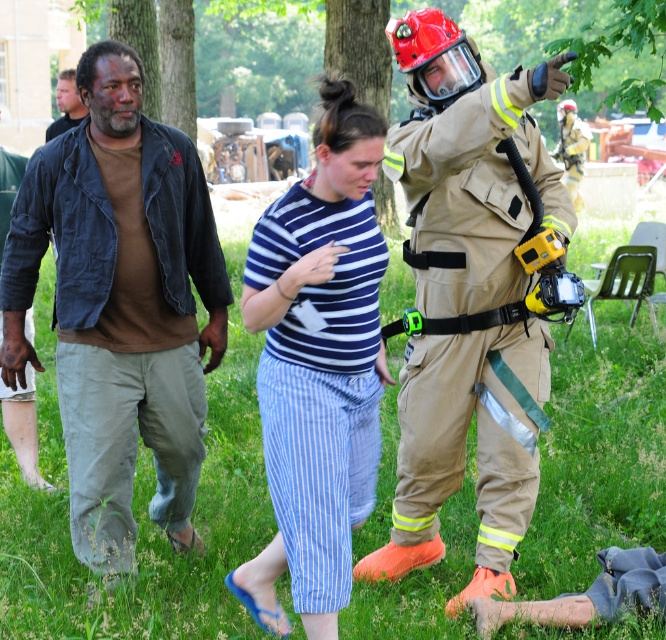
Which is below, brown cotton shirt at left or blue striped pants at center?

blue striped pants at center

Based on the photo, between brown cotton shirt at left and blue striped pants at center, which one has less height?

Standing shorter between the two is blue striped pants at center.

Where is `brown cotton shirt at left`? This screenshot has height=640, width=666. brown cotton shirt at left is located at coordinates (121, 305).

Who is more distant from viewer, (330,163) or (567,157)?

Point (567,157)

Does blue striped pants at center have a larger size compared to tan protective suit at center?

Correct, blue striped pants at center is larger in size than tan protective suit at center.

Locate an element on the screen. blue striped pants at center is located at coordinates (318, 364).

Looking at this image, is blue striped pants at center to the left of brown cotton shirt at upper left from the viewer's perspective?

No, blue striped pants at center is not to the left of brown cotton shirt at upper left.

Is blue striped pants at center shorter than brown cotton shirt at upper left?

Correct, blue striped pants at center is not as tall as brown cotton shirt at upper left.

Image resolution: width=666 pixels, height=640 pixels. In order to click on blue striped pants at center in this screenshot , I will do `click(318, 364)`.